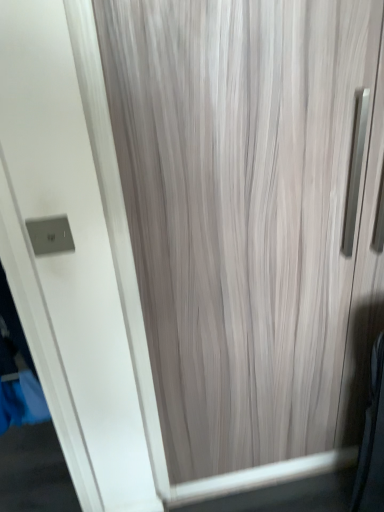
Describe the element at coordinates (239, 213) in the screenshot. I see `wooden door at center` at that location.

The width and height of the screenshot is (384, 512). I want to click on wooden door at center, so click(x=239, y=213).

What is the approximate width of satin silver switch at upper left?

The width of satin silver switch at upper left is 1.00 centimeters.

I want to click on satin silver switch at upper left, so click(50, 234).

Describe the element at coordinates (50, 234) in the screenshot. The width and height of the screenshot is (384, 512). I see `satin silver switch at upper left` at that location.

Where is `wooden door at center`? The width and height of the screenshot is (384, 512). wooden door at center is located at coordinates (239, 213).

Between satin silver switch at upper left and wooden door at center, which one appears on the left side from the viewer's perspective?

From the viewer's perspective, satin silver switch at upper left appears more on the left side.

Which object is more forward, satin silver switch at upper left or wooden door at center?

wooden door at center is more forward.

Considering the points (55, 233) and (114, 49), which point is behind, point (55, 233) or point (114, 49)?

The point (55, 233) is behind.

From the image's perspective, is satin silver switch at upper left located above or below wooden door at center?

satin silver switch at upper left is situated higher than wooden door at center in the image.

From a real-world perspective, which is physically below, satin silver switch at upper left or wooden door at center?

wooden door at center.

Between satin silver switch at upper left and wooden door at center, which one has smaller width?

satin silver switch at upper left.

Which of these two, satin silver switch at upper left or wooden door at center, stands taller?

wooden door at center is taller.

Considering the relative sizes of satin silver switch at upper left and wooden door at center in the image provided, is satin silver switch at upper left smaller than wooden door at center?

Indeed, satin silver switch at upper left has a smaller size compared to wooden door at center.

Would you say wooden door at center is part of satin silver switch at upper left's contents?

No, wooden door at center is located outside of satin silver switch at upper left.

Is the surface of satin silver switch at upper left in direct contact with wooden door at center?

There is a gap between satin silver switch at upper left and wooden door at center.

Is wooden door at center at the back of satin silver switch at upper left?

satin silver switch at upper left is not turned away from wooden door at center.

Where is `electric outlet on the left of wooden door at center`? The height and width of the screenshot is (512, 384). electric outlet on the left of wooden door at center is located at coordinates (50, 234).

Considering the relative positions of wooden door at center and satin silver switch at upper left in the image provided, is wooden door at center to the left or to the right of satin silver switch at upper left?

Based on their positions, wooden door at center is located to the right of satin silver switch at upper left.

Who is more distant, wooden door at center or satin silver switch at upper left?

satin silver switch at upper left is more distant.

Is point (297, 113) closer or farther from the camera than point (55, 250)?

Point (297, 113) is closer to the camera than point (55, 250).

From the image's perspective, does wooden door at center appear lower than satin silver switch at upper left?

Correct, wooden door at center appears lower than satin silver switch at upper left in the image.

From a real-world perspective, who is located higher, wooden door at center or satin silver switch at upper left?

satin silver switch at upper left is physically above.

Which of these two, wooden door at center or satin silver switch at upper left, is wider?

With larger width is wooden door at center.

Considering the sizes of objects wooden door at center and satin silver switch at upper left in the image provided, who is taller, wooden door at center or satin silver switch at upper left?

With more height is wooden door at center.

Does wooden door at center have a smaller size compared to satin silver switch at upper left?

Incorrect, wooden door at center is not smaller in size than satin silver switch at upper left.

Can we say wooden door at center lies outside satin silver switch at upper left?

That's correct, wooden door at center is outside of satin silver switch at upper left.

In the scene shown: Is wooden door at center next to satin silver switch at upper left and touching it?

No, wooden door at center is not making contact with satin silver switch at upper left.

Is wooden door at center facing towards satin silver switch at upper left?

No, wooden door at center does not turn towards satin silver switch at upper left.

Can you tell me how much wooden door at center and satin silver switch at upper left differ in facing direction?

The facing directions of wooden door at center and satin silver switch at upper left are 0.869 degrees apart.

Measure the distance from wooden door at center to satin silver switch at upper left.

wooden door at center and satin silver switch at upper left are 49.92 centimeters apart.

The height and width of the screenshot is (512, 384). I want to click on curtain below the satin silver switch at upper left (from a real-world perspective), so click(x=239, y=213).

Locate an element on the screen. curtain directly beneath the satin silver switch at upper left (from a real-world perspective) is located at coordinates (239, 213).

At what (x,y) coordinates should I click in order to perform the action: click on electric outlet above the wooden door at center (from the image's perspective). Please return your answer as a coordinate pair (x, y). The image size is (384, 512). Looking at the image, I should click on (50, 234).